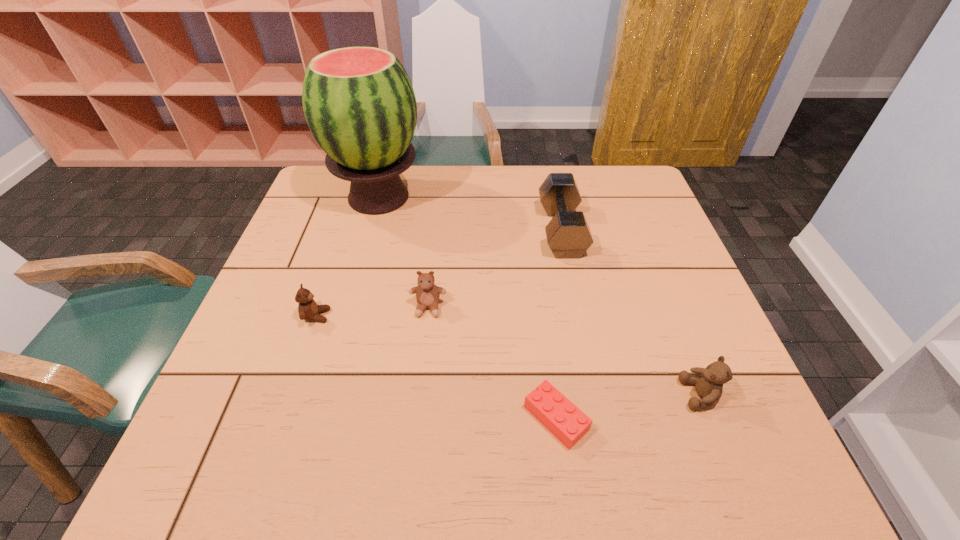
What are the coordinates of `free space between the Lego and the watermelon` in the screenshot? It's located at (468, 308).

The image size is (960, 540). What are the coordinates of `vacant space that's between the leftmost teddy bear and the dumbbell` in the screenshot? It's located at point(439,273).

The width and height of the screenshot is (960, 540). Find the location of `vacant point located between the leftmost teddy bear and the rightmost object`. vacant point located between the leftmost teddy bear and the rightmost object is located at coordinates (509, 355).

At what (x,y) coordinates should I click in order to perform the action: click on unoccupied area between the watermelon and the leftmost teddy bear. Please return your answer as a coordinate pair (x, y). Looking at the image, I should click on (348, 256).

Find the location of a particular element. The height and width of the screenshot is (540, 960). vacant space that is in between the shortest object and the tallest object is located at coordinates (468, 308).

In order to click on free area in between the leftmost teddy bear and the Lego in this screenshot , I will do `click(436, 367)`.

Image resolution: width=960 pixels, height=540 pixels. Identify the location of free area in between the fourth object from right to left and the rightmost teddy bear. (564, 351).

At what (x,y) coordinates should I click in order to perform the action: click on empty space that is in between the leftmost teddy bear and the second teddy bear from right to left. Please return your answer as a coordinate pair (x, y). The height and width of the screenshot is (540, 960). Looking at the image, I should click on (372, 312).

Identify which object is the fourth closest to the dumbbell. Please provide its 2D coordinates. Your answer should be formatted as a tuple, i.e. [(x, y)], where the tuple contains the x and y coordinates of a point satisfying the conditions above.

[(558, 414)]

Where is `the closest object relative to the dumbbell`? the closest object relative to the dumbbell is located at coordinates (427, 293).